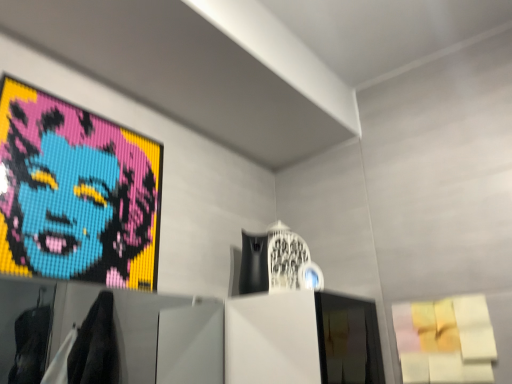
The image size is (512, 384). Describe the element at coordinates (76, 193) in the screenshot. I see `pop art portrait at upper left` at that location.

What is the approximate width of pop art portrait at upper left?

The width of pop art portrait at upper left is 1.26 inches.

The image size is (512, 384). In order to click on pop art portrait at upper left in this screenshot , I will do `click(76, 193)`.

Locate an element on the screen. This screenshot has width=512, height=384. pop art portrait at upper left is located at coordinates (76, 193).